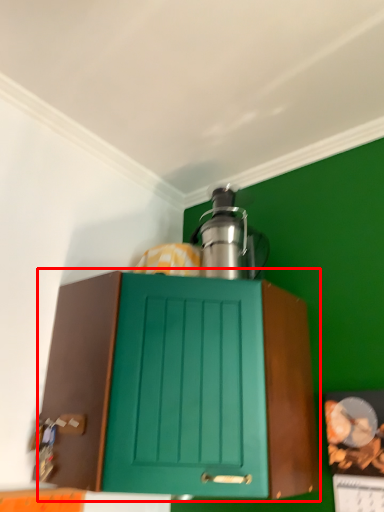
Question: Observing the image, what is the correct spatial positioning of cabinetry (annotated by the red box) in reference to kitchen appliance?

Choices:
 (A) right
 (B) left

Answer: (B)